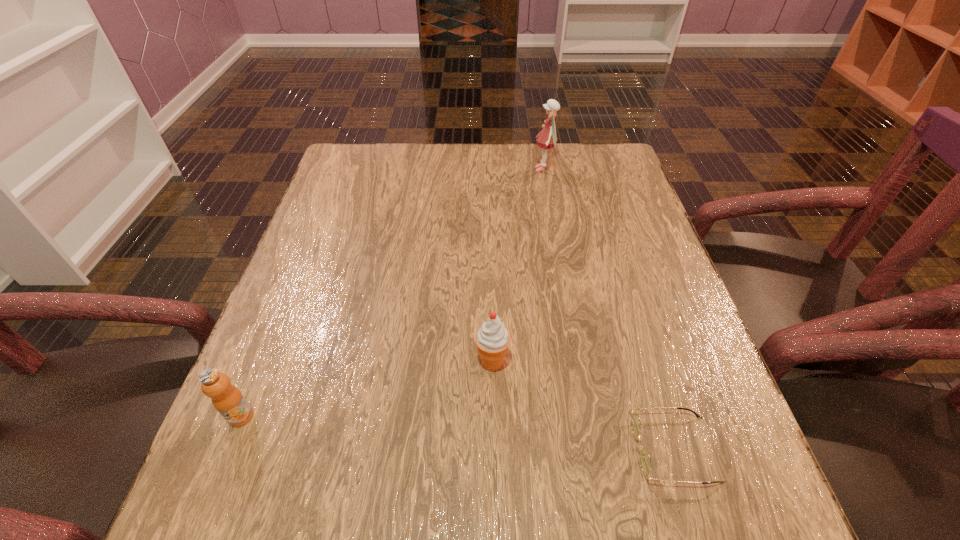
You are a GUI agent. You are given a task and a screenshot of the screen. Output one action in this format:
    pyautogui.click(x=<x>, y=<y>)
    Task: Click on the vacant space that satisfies the following two spatial constraints: 1. on the front-facing side of the tallest object; 2. on the front label of the leftmost object
    This screenshot has height=540, width=960.
    Given the screenshot: What is the action you would take?
    pyautogui.click(x=588, y=416)